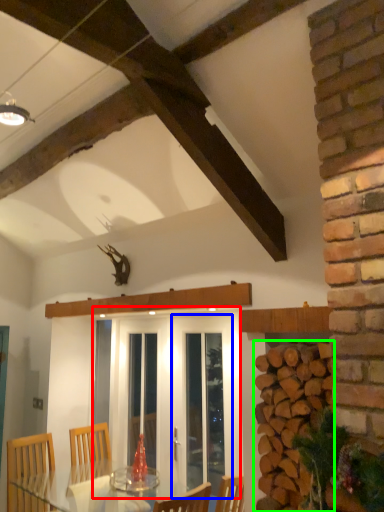
Question: Estimate the real-world distances between objects in this image. Which object is closer to screen door (highlighted by a red box), screen door (highlighted by a blue box) or brickwork (highlighted by a green box)?

Choices:
 (A) screen door
 (B) brickwork

Answer: (A)